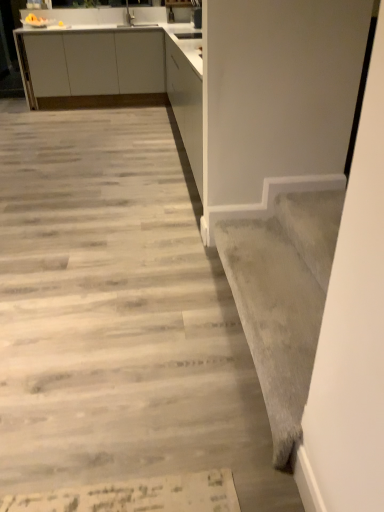
Question: Does white matte cabinet at upper left have a greater height compared to gray carpet at lower right?

Choices:
 (A) no
 (B) yes

Answer: (B)

Question: Can you confirm if white matte cabinet at upper left is thinner than gray carpet at lower right?

Choices:
 (A) no
 (B) yes

Answer: (A)

Question: Is white matte cabinet at upper left facing away from gray carpet at lower right?

Choices:
 (A) yes
 (B) no

Answer: (B)

Question: From the image's perspective, does white matte cabinet at upper left appear lower than gray carpet at lower right?

Choices:
 (A) yes
 (B) no

Answer: (B)

Question: Can you confirm if white matte cabinet at upper left is positioned to the left of gray carpet at lower right?

Choices:
 (A) no
 (B) yes

Answer: (B)

Question: From their relative heights in the image, would you say gray wood floor at center is taller or shorter than white matte cabinet at upper left?

Choices:
 (A) short
 (B) tall

Answer: (A)

Question: Is point [x=44, y=236] positioned closer to the camera than point [x=188, y=81]?

Choices:
 (A) closer
 (B) farther

Answer: (A)

Question: Would you say gray wood floor at center is to the left or to the right of white matte cabinet at upper left in the picture?

Choices:
 (A) left
 (B) right

Answer: (A)

Question: From the image's perspective, is gray wood floor at center located above or below white matte cabinet at upper left?

Choices:
 (A) above
 (B) below

Answer: (B)

Question: In terms of width, does white matte cabinet at upper left look wider or thinner when compared to gray wood floor at center?

Choices:
 (A) wide
 (B) thin

Answer: (B)

Question: From their relative heights in the image, would you say white matte cabinet at upper left is taller or shorter than gray wood floor at center?

Choices:
 (A) short
 (B) tall

Answer: (B)

Question: From a real-world perspective, is white matte cabinet at upper left above or below gray wood floor at center?

Choices:
 (A) above
 (B) below

Answer: (A)

Question: In the image, is white matte cabinet at upper left on the left side or the right side of gray wood floor at center?

Choices:
 (A) left
 (B) right

Answer: (B)

Question: Is gray carpet at lower right inside the boundaries of gray wood floor at center, or outside?

Choices:
 (A) outside
 (B) inside

Answer: (A)

Question: From a real-world perspective, relative to gray wood floor at center, is gray carpet at lower right vertically above or below?

Choices:
 (A) below
 (B) above

Answer: (B)